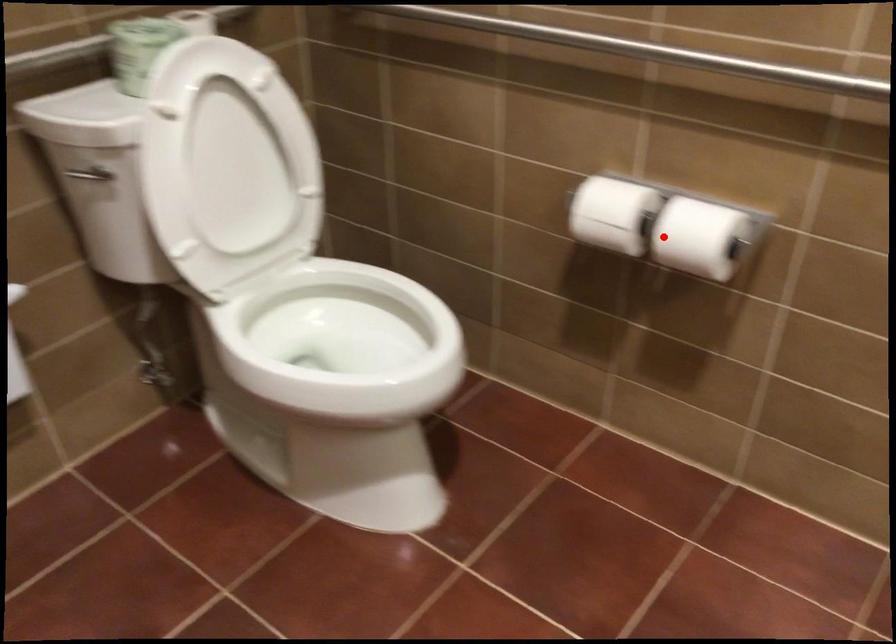
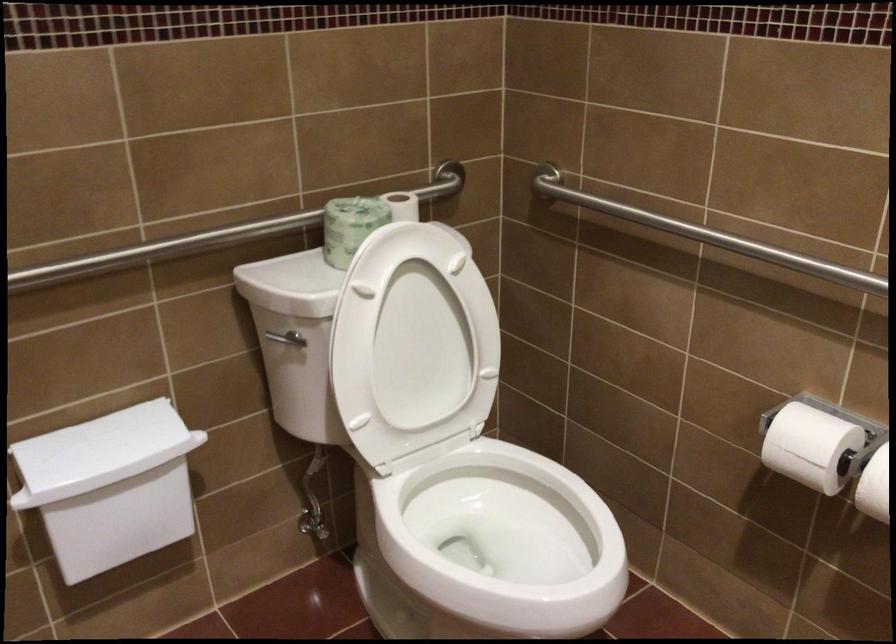
Question: I am providing you with two images of the same scene from different viewpoints. A red point is shown in image1. For the corresponding object point in image2, is it positioned nearer or farther from the camera?

Choices:
 (A) Nearer
 (B) Farther

Answer: (A)